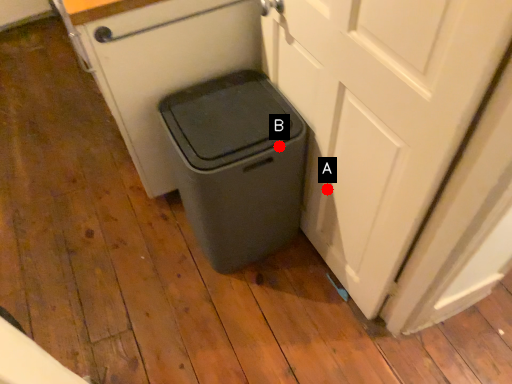
Question: Two points are circled on the image, labeled by A and B beside each circle. Which point is closer to the camera taking this photo?

Choices:
 (A) A is closer
 (B) B is closer

Answer: (B)